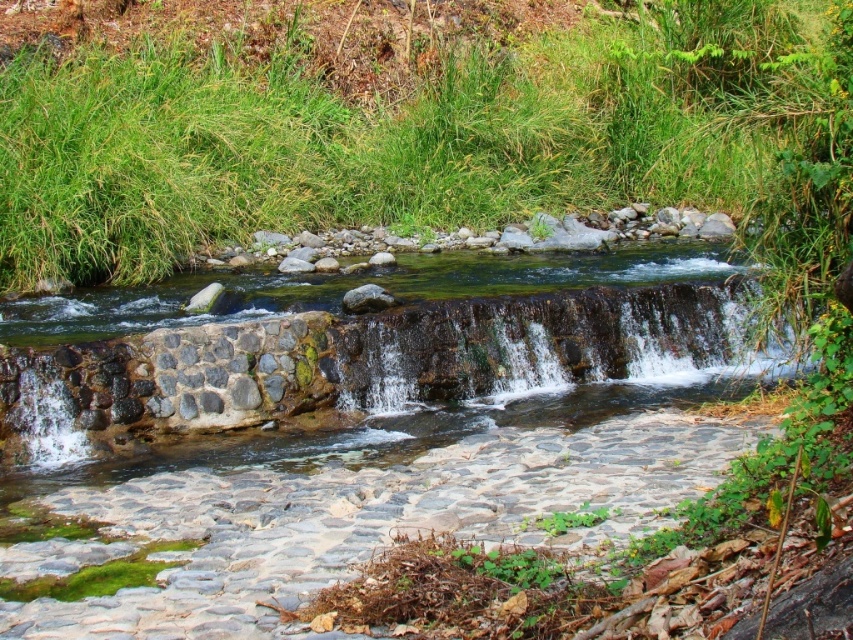
Which is above, green grass at upper center or dark brown stone waterfall at center?

green grass at upper center is higher up.

Is point (286, 211) less distant than point (367, 385)?

No, (286, 211) is behind (367, 385).

What do you see at coordinates (426, 138) in the screenshot?
I see `green grass at upper center` at bounding box center [426, 138].

Where is `green grass at upper center`? The width and height of the screenshot is (853, 640). green grass at upper center is located at coordinates (426, 138).